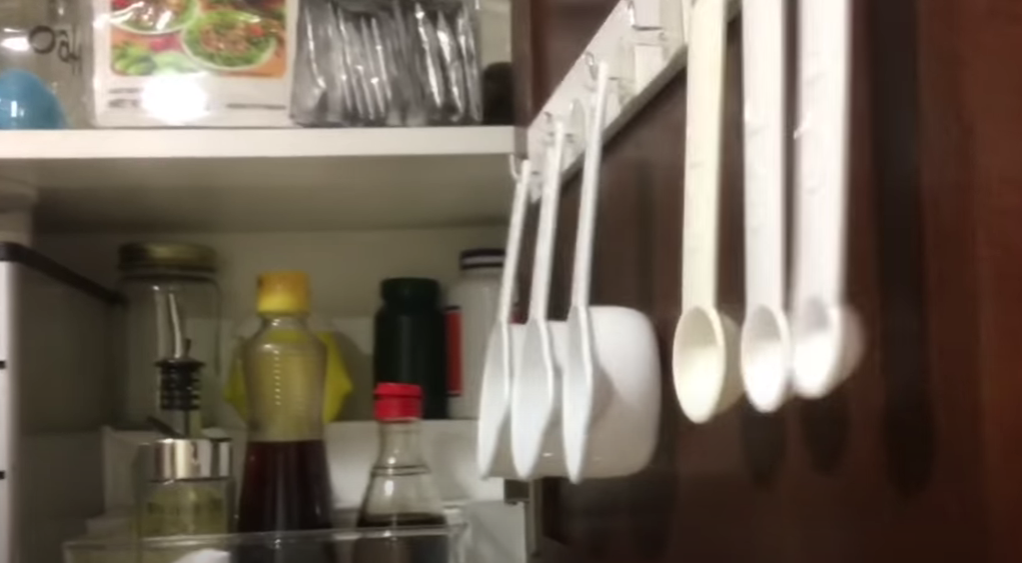
Find the location of a particular element. silver jar cap is located at coordinates (165, 250).